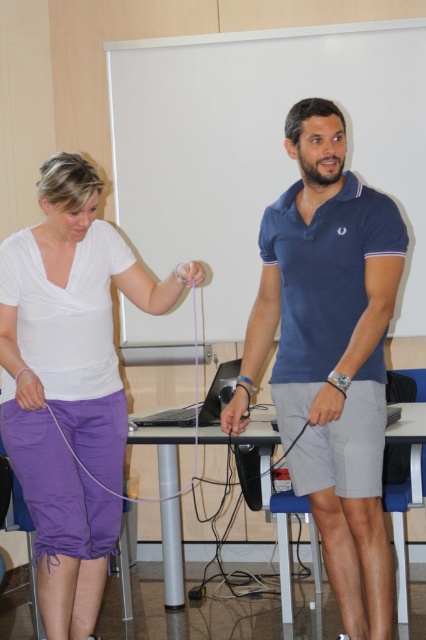
Question: Is matte white shirt at center below navy blue polo shirt at center?

Choices:
 (A) yes
 (B) no

Answer: (A)

Question: Which of the following is the closest to the observer?

Choices:
 (A) (285, 275)
 (B) (293, 285)
 (C) (37, 384)
 (D) (91, 324)

Answer: (C)

Question: Is the position of blue cotton polo shirt at center less distant than that of matte black laptop at center?

Choices:
 (A) yes
 (B) no

Answer: (A)

Question: Which point is closer to the camera?

Choices:
 (A) (40, 404)
 (B) (319, 353)

Answer: (A)

Question: Which object is farther from the camera taking this photo?

Choices:
 (A) matte white shirt at center
 (B) navy blue polo shirt at center

Answer: (A)

Question: Does navy blue polo shirt at center have a smaller size compared to matte black laptop at center?

Choices:
 (A) no
 (B) yes

Answer: (A)